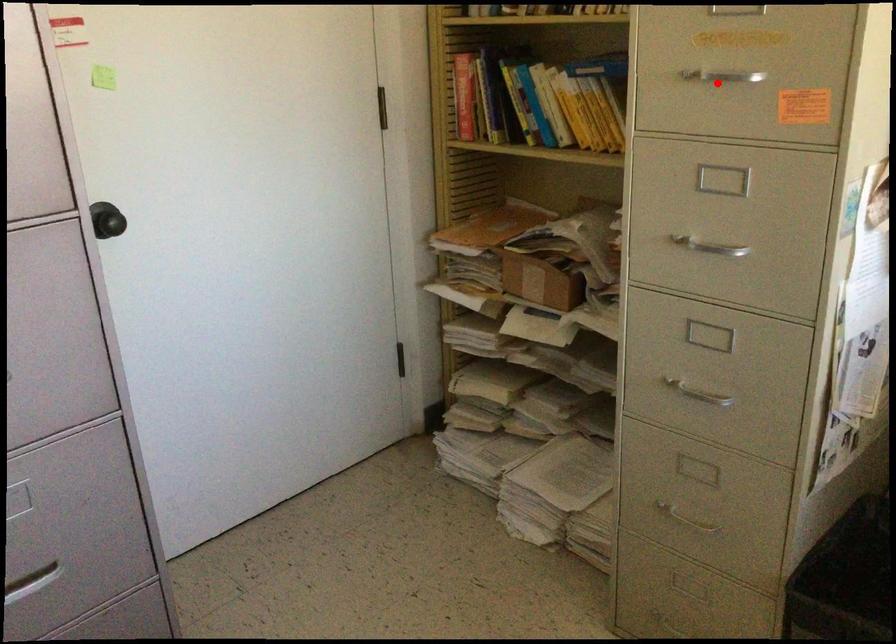
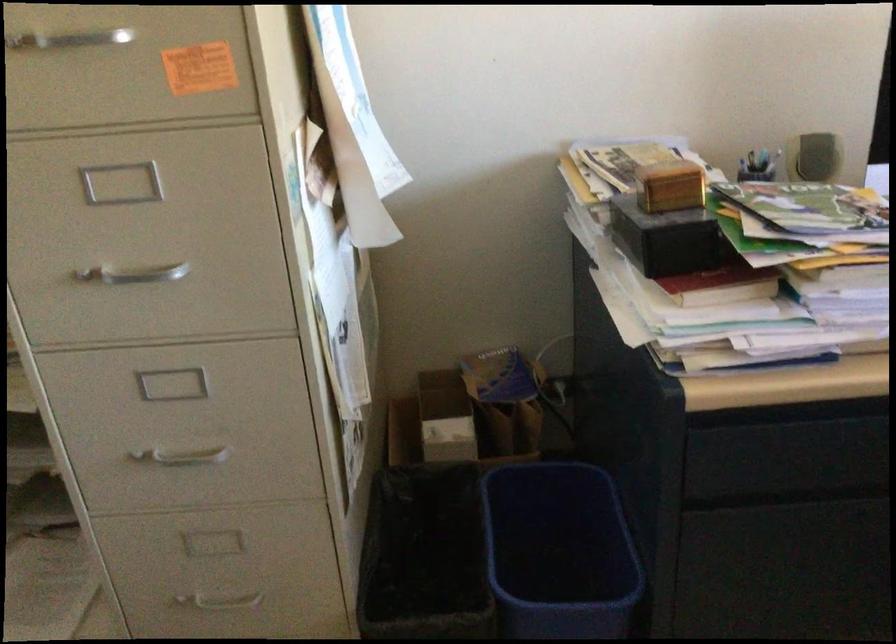
Question: I am providing you with two images of the same scene from different viewpoints. In image1, a red point is highlighted. Considering the same 3D point in image2, which of the following is correct?

Choices:
 (A) It is closer
 (B) It is farther

Answer: (A)